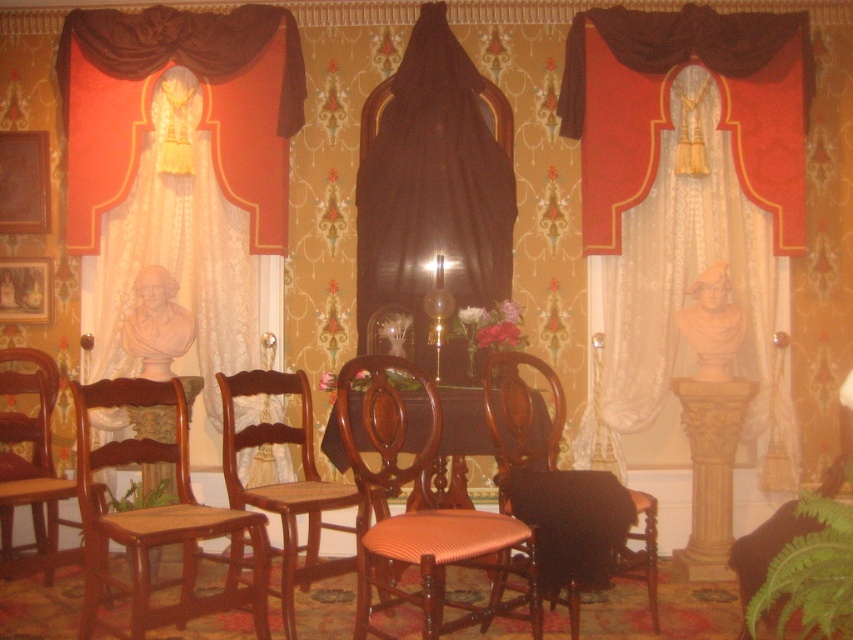
Question: Which of the following is the closest to the observer?

Choices:
 (A) (772, 45)
 (B) (154, 540)

Answer: (B)

Question: Can you confirm if wooden cane chair at center is positioned below wooden armchair at left?

Choices:
 (A) no
 (B) yes

Answer: (B)

Question: Can you confirm if wooden cane chair at center is positioned below wooden armchair at left?

Choices:
 (A) no
 (B) yes

Answer: (B)

Question: Is wooden cane chair at center wider than wooden armchair at center?

Choices:
 (A) no
 (B) yes

Answer: (B)

Question: Which point appears closest to the camera in this image?

Choices:
 (A) (244, 429)
 (B) (48, 419)
 (C) (434, 531)
 (D) (495, 420)

Answer: (C)

Question: Which of these objects is positioned farthest from the gold metallic lamp at center?

Choices:
 (A) wooden chair with woven seat at center
 (B) brown wood table at center
 (C) velvet drapery at center

Answer: (C)